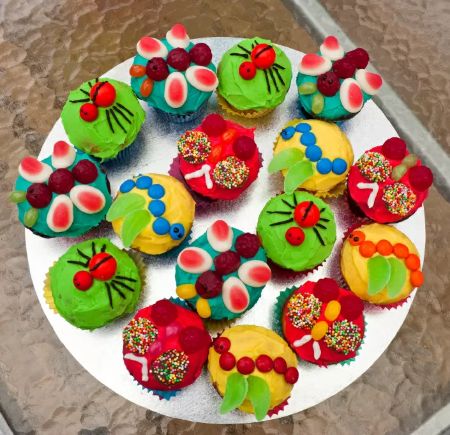
Where is `metal bar of glass table`? metal bar of glass table is located at coordinates (397, 104), (435, 423), (2, 425).